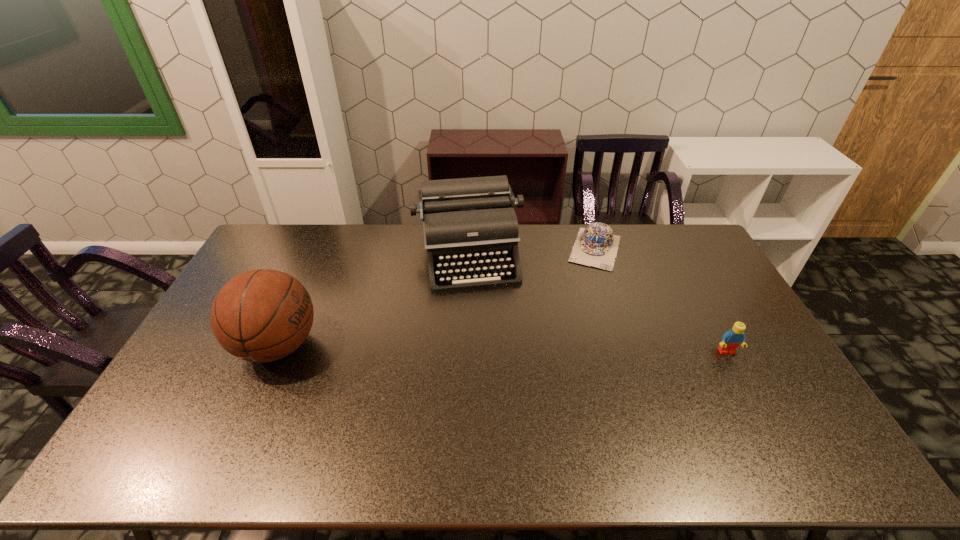
In order to click on vacant point located on the typing side of the typewriter in this screenshot , I will do `click(488, 360)`.

The width and height of the screenshot is (960, 540). I want to click on vacant region located on the front, side, and top of the shortest object, so click(567, 349).

I want to click on vacant space positioned 0.300m on the front, side, and top of the shortest object, so click(574, 328).

Image resolution: width=960 pixels, height=540 pixels. Identify the location of vacant point located 0.210m on the front, side, and top of the shortest object. (580, 309).

What are the coordinates of `typewriter located in the far edge section of the desktop` in the screenshot? It's located at pyautogui.click(x=470, y=225).

Locate an element on the screen. This screenshot has height=540, width=960. cap at the far edge is located at coordinates (596, 246).

The width and height of the screenshot is (960, 540). In order to click on object at the left edge in this screenshot , I will do `click(263, 315)`.

This screenshot has width=960, height=540. I want to click on object that is at the right edge, so click(734, 337).

The height and width of the screenshot is (540, 960). Identify the location of free location at the far edge. (525, 254).

This screenshot has height=540, width=960. In the image, there is a desktop. Identify the location of vacant space at the far left corner. (282, 240).